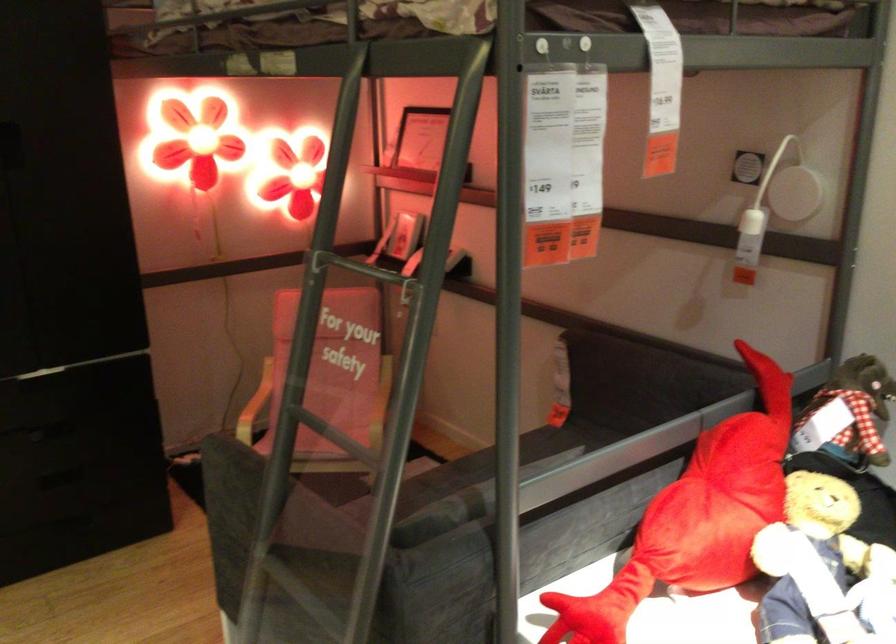
Find where to lift the red stuffed toy. Please return your answer as a coordinate pair (x, y).

(719, 502)